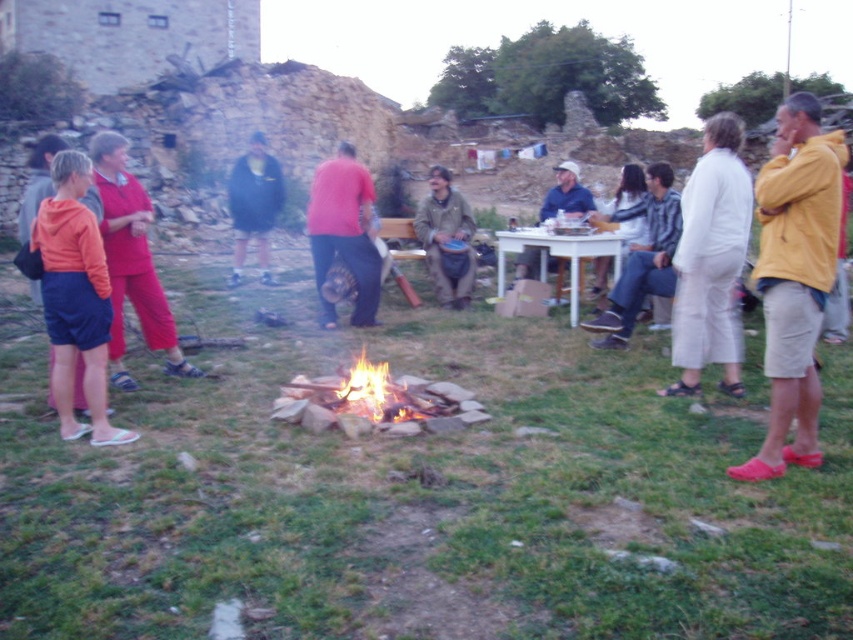
Which is more to the right, white cotton pants at center or matte pink shirt at center?

From the viewer's perspective, white cotton pants at center appears more on the right side.

Which is above, white cotton pants at center or matte pink shirt at center?

matte pink shirt at center is higher up.

Is point (703, 157) positioned after point (370, 294)?

No, it is not.

You are a GUI agent. You are given a task and a screenshot of the screen. Output one action in this format:
    pyautogui.click(x=<x>, y=<y>)
    Task: Click on the white cotton pants at center
    This screenshot has width=853, height=640.
    Given the screenshot: What is the action you would take?
    pyautogui.click(x=711, y=259)

The width and height of the screenshot is (853, 640). What do you see at coordinates (793, 276) in the screenshot?
I see `yellow fabric jacket at right` at bounding box center [793, 276].

From the picture: Can you confirm if yellow fabric jacket at right is positioned below white cotton pants at center?

Incorrect, yellow fabric jacket at right is not positioned below white cotton pants at center.

Locate an element on the screen. yellow fabric jacket at right is located at coordinates (793, 276).

Can you confirm if white cotton pants at center is positioned to the right of flaming wood at center?

Correct, you'll find white cotton pants at center to the right of flaming wood at center.

What do you see at coordinates (711, 259) in the screenshot? I see `white cotton pants at center` at bounding box center [711, 259].

At what (x,y) coordinates should I click in order to perform the action: click on white cotton pants at center. Please return your answer as a coordinate pair (x, y). The width and height of the screenshot is (853, 640). Looking at the image, I should click on (711, 259).